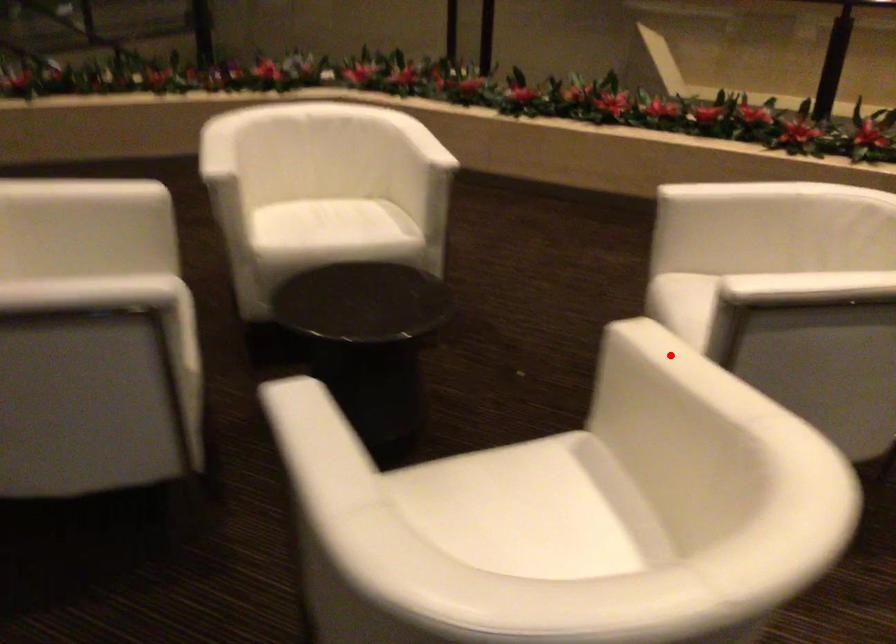
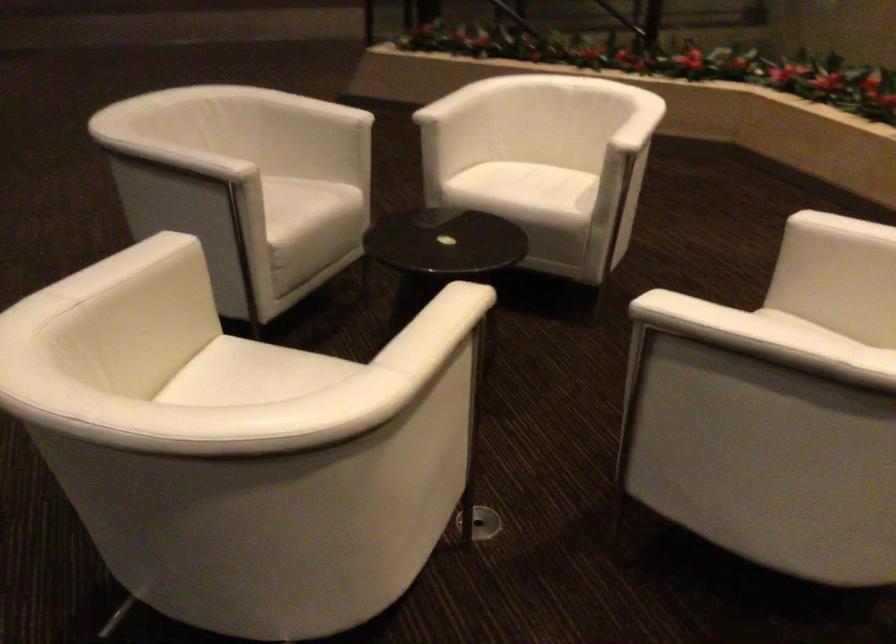
In the second image, find the point that corresponds to the highlighted location in the first image.

(437, 308)